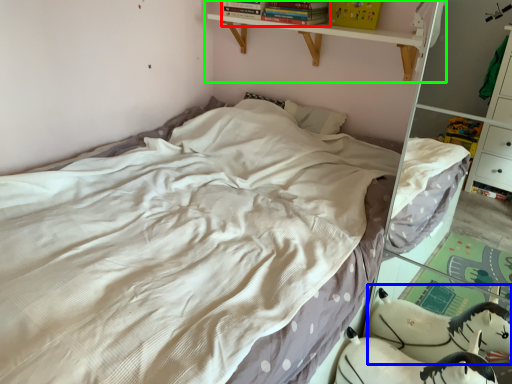
Question: Which object is positioned farthest from book (highlighted by a red box)? Select from animal (highlighted by a blue box) and shelf (highlighted by a green box).

Choices:
 (A) animal
 (B) shelf

Answer: (A)